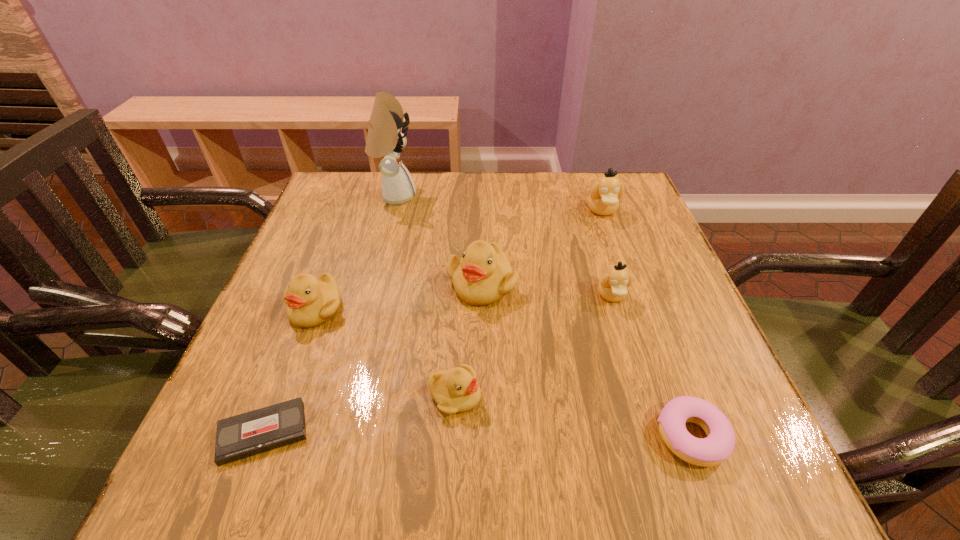
Identify the location of black doll. (386, 137).

At what (x,y) coordinates should I click in order to perform the action: click on the tallest object. Please return your answer as a coordinate pair (x, y). The height and width of the screenshot is (540, 960). Looking at the image, I should click on (386, 137).

Locate an element on the screen. Image resolution: width=960 pixels, height=540 pixels. the bigger tan duckling is located at coordinates (603, 199).

Identify the location of the farthest duckling. (603, 199).

What are the coordinates of `the biggest yellow duckling` in the screenshot? It's located at (483, 276).

Identify the location of the second smallest yellow duckling. Image resolution: width=960 pixels, height=540 pixels. (310, 301).

Identify the location of the leftmost yellow duckling. (310, 301).

Identify the location of the nearer tan duckling. (612, 286).

Image resolution: width=960 pixels, height=540 pixels. Find the location of `the nearest duckling`. the nearest duckling is located at coordinates (455, 391).

This screenshot has height=540, width=960. In order to click on the third shortest object in this screenshot , I will do `click(455, 391)`.